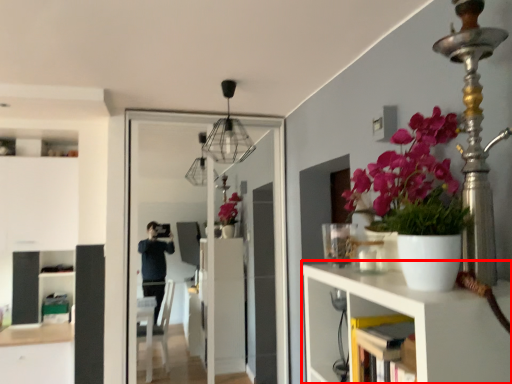
Question: From the image's perspective, what is the correct spatial relationship of shelf (annotated by the red box) in relation to screen door?

Choices:
 (A) above
 (B) below

Answer: (B)